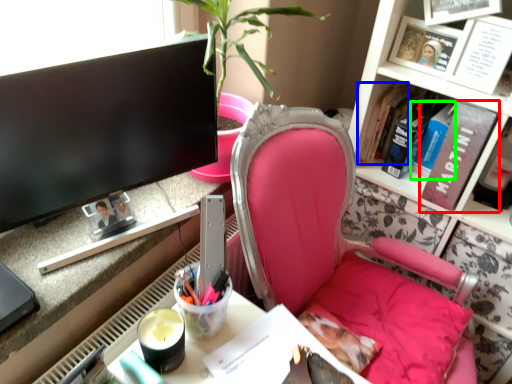
Question: Which object is positioned closest to book (highlighted by a red box)? Select from book (highlighted by a blue box) and book (highlighted by a green box).

Choices:
 (A) book
 (B) book

Answer: (B)